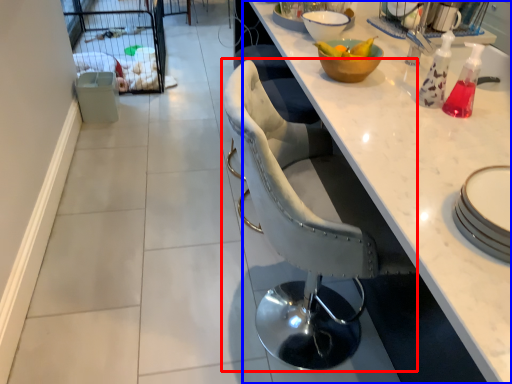
Question: Which object is closer to the camera taking this photo, chair (highlighted by a red box) or countertop (highlighted by a blue box)?

Choices:
 (A) chair
 (B) countertop

Answer: (A)